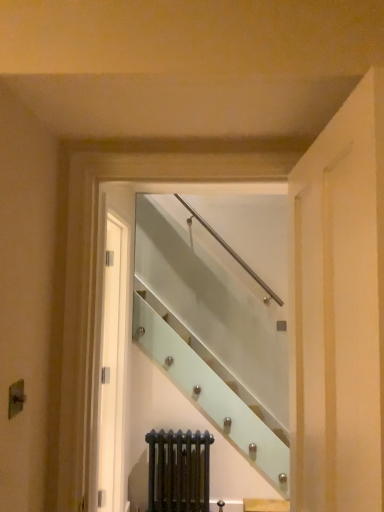
What do you see at coordinates (212, 331) in the screenshot? I see `clear glass staircase at center` at bounding box center [212, 331].

Measure the distance between clear glass staircase at center and camera.

clear glass staircase at center and camera are 3.62 meters apart.

Image resolution: width=384 pixels, height=512 pixels. In order to click on clear glass staircase at center in this screenshot , I will do (x=212, y=331).

Describe the element at coordinates (178, 471) in the screenshot. This screenshot has width=384, height=512. I see `dark green radiator at lower center` at that location.

Identify the location of dark green radiator at lower center. (178, 471).

This screenshot has height=512, width=384. Find the location of `clear glass staircase at center`. clear glass staircase at center is located at coordinates (212, 331).

Is dark green radiator at lower center to the left or to the right of clear glass staircase at center in the image?

Based on their positions, dark green radiator at lower center is located to the left of clear glass staircase at center.

Is the depth of dark green radiator at lower center greater than that of clear glass staircase at center?

Yes, dark green radiator at lower center is further from the viewer.

Is point (149, 432) farther from viewer compared to point (257, 464)?

Yes, it is behind point (257, 464).

From the image's perspective, is dark green radiator at lower center beneath clear glass staircase at center?

Correct, dark green radiator at lower center appears lower than clear glass staircase at center in the image.

From a real-world perspective, does dark green radiator at lower center stand above clear glass staircase at center?

Incorrect, from a real-world perspective, dark green radiator at lower center is lower than clear glass staircase at center.

In terms of width, does dark green radiator at lower center look wider or thinner when compared to clear glass staircase at center?

Clearly, dark green radiator at lower center has less width compared to clear glass staircase at center.

Between dark green radiator at lower center and clear glass staircase at center, which one has less height?

dark green radiator at lower center is shorter.

Between dark green radiator at lower center and clear glass staircase at center, which one has smaller size?

Smaller between the two is dark green radiator at lower center.

Is clear glass staircase at center located within dark green radiator at lower center?

No, clear glass staircase at center is not surrounded by dark green radiator at lower center.

Is dark green radiator at lower center beside clear glass staircase at center?

No, dark green radiator at lower center is not touching clear glass staircase at center.

Is dark green radiator at lower center facing towards clear glass staircase at center?

No, dark green radiator at lower center is not aimed at clear glass staircase at center.

How different are the orientations of dark green radiator at lower center and clear glass staircase at center in degrees?

They differ by 0.0577 degrees in their facing directions.

Where is `escalator on the right of dark green radiator at lower center`? Image resolution: width=384 pixels, height=512 pixels. escalator on the right of dark green radiator at lower center is located at coordinates (212, 331).

Considering the positions of objects clear glass staircase at center and dark green radiator at lower center in the image provided, who is more to the left, clear glass staircase at center or dark green radiator at lower center?

dark green radiator at lower center is more to the left.

Which object is further away from the camera, clear glass staircase at center or dark green radiator at lower center?

dark green radiator at lower center.

Considering the points (266, 328) and (152, 494), which point is in front, point (266, 328) or point (152, 494)?

Point (152, 494)

From the image's perspective, is clear glass staircase at center above or below dark green radiator at lower center?

clear glass staircase at center is above dark green radiator at lower center.

From a real-world perspective, between clear glass staircase at center and dark green radiator at lower center, who is vertically lower?

dark green radiator at lower center, from a real-world perspective.

Does clear glass staircase at center have a greater width compared to dark green radiator at lower center?

Yes, clear glass staircase at center is wider than dark green radiator at lower center.

Considering the relative sizes of clear glass staircase at center and dark green radiator at lower center in the image provided, is clear glass staircase at center shorter than dark green radiator at lower center?

Incorrect, the height of clear glass staircase at center does not fall short of that of dark green radiator at lower center.

Is clear glass staircase at center bigger or smaller than dark green radiator at lower center?

In the image, clear glass staircase at center appears to be larger than dark green radiator at lower center.

Does clear glass staircase at center contain dark green radiator at lower center?

No, dark green radiator at lower center is not inside clear glass staircase at center.

Based on the photo, is clear glass staircase at center next to dark green radiator at lower center?

No, clear glass staircase at center is not making contact with dark green radiator at lower center.

Is clear glass staircase at center aimed at dark green radiator at lower center?

No, clear glass staircase at center is not oriented towards dark green radiator at lower center.

Where is `escalator that is above the dark green radiator at lower center (from a real-world perspective)`? Image resolution: width=384 pixels, height=512 pixels. escalator that is above the dark green radiator at lower center (from a real-world perspective) is located at coordinates 212,331.

Identify the location of escalator lying on the right of dark green radiator at lower center. (212, 331).

What are the coordinates of `radiator lying below the clear glass staircase at center (from the image's perspective)` in the screenshot? It's located at (178, 471).